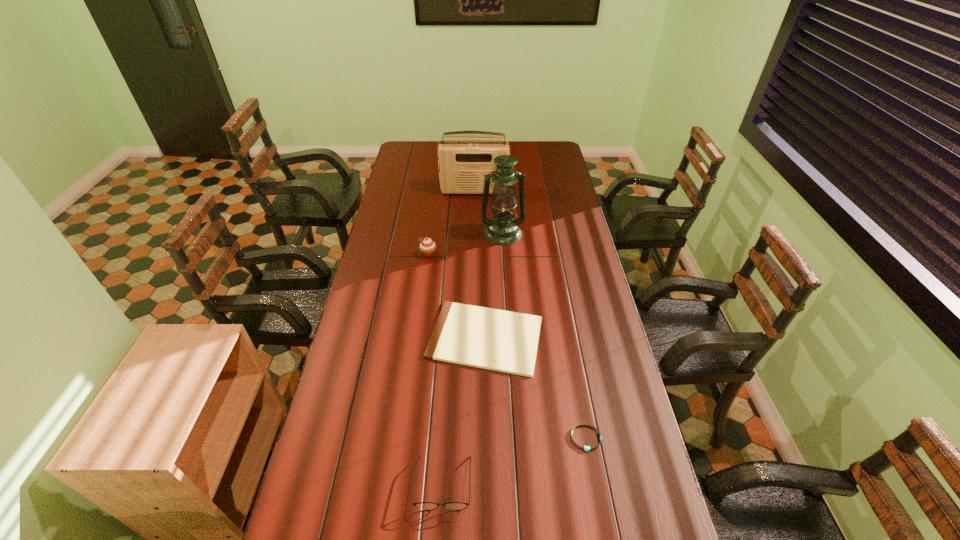
Locate which object is the closest to the wristband. Please provide its 2D coordinates. Your answer should be formatted as a tuple, i.e. [(x, y)], where the tuple contains the x and y coordinates of a point satisfying the conditions above.

[(498, 340)]

Image resolution: width=960 pixels, height=540 pixels. Find the location of `free location that satisfies the following two spatial constraints: 1. on the front-facing side of the fourth farthest object; 2. on the left side of the radio receiver`. free location that satisfies the following two spatial constraints: 1. on the front-facing side of the fourth farthest object; 2. on the left side of the radio receiver is located at coordinates (471, 338).

Find the location of a particular element. vacant space that satisfies the following two spatial constraints: 1. on the front-facing side of the fifth shortest object; 2. on the right side of the fourth farthest object is located at coordinates (471, 338).

Identify the location of vacant region that satisfies the following two spatial constraints: 1. on the front-facing side of the farthest object; 2. on the right side of the tallest object. Image resolution: width=960 pixels, height=540 pixels. (473, 233).